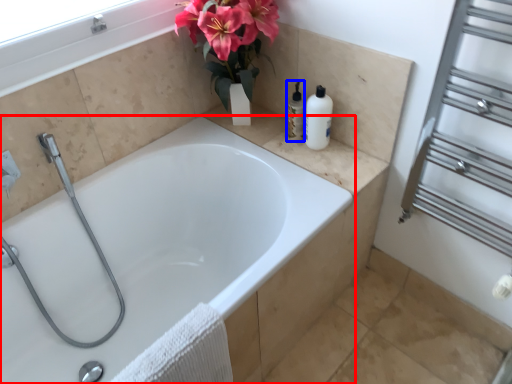
Question: Which point is closer to the camera, bathtub (highlighted by a red box) or toiletry (highlighted by a blue box)?

Choices:
 (A) bathtub
 (B) toiletry

Answer: (A)